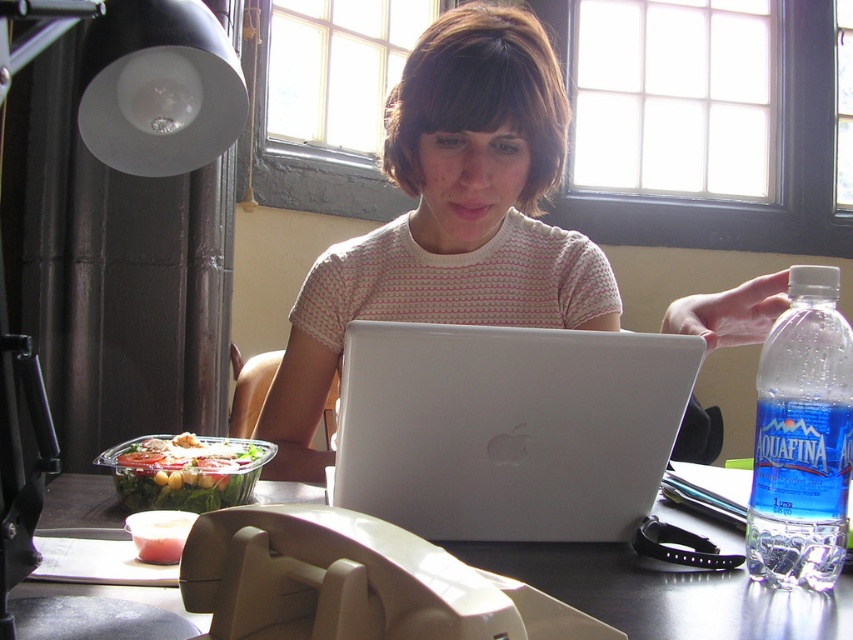
You are a delivery robot with a 35 cm wide package. You need to place it between the black plastic table at center and the fresh green salad at left. Can you fit the package between them?

The black plastic table at center and the fresh green salad at left are 37.49 centimeters apart. Since the package is 35 cm wide, it can fit between them with 2.49 centimeters of space remaining.

You are a person who wants to place a 10 cm tall book on the desk. The book requires at least 5 cm of vertical space to stand upright. Can the book fit vertically between the white matte laptop at center and the black plastic table at center?

The white matte laptop at center is taller than the black plastic table at center, so there is insufficient vertical space between them for the book to stand upright. The book cannot fit vertically between the white matte laptop at center and the black plastic table at center.